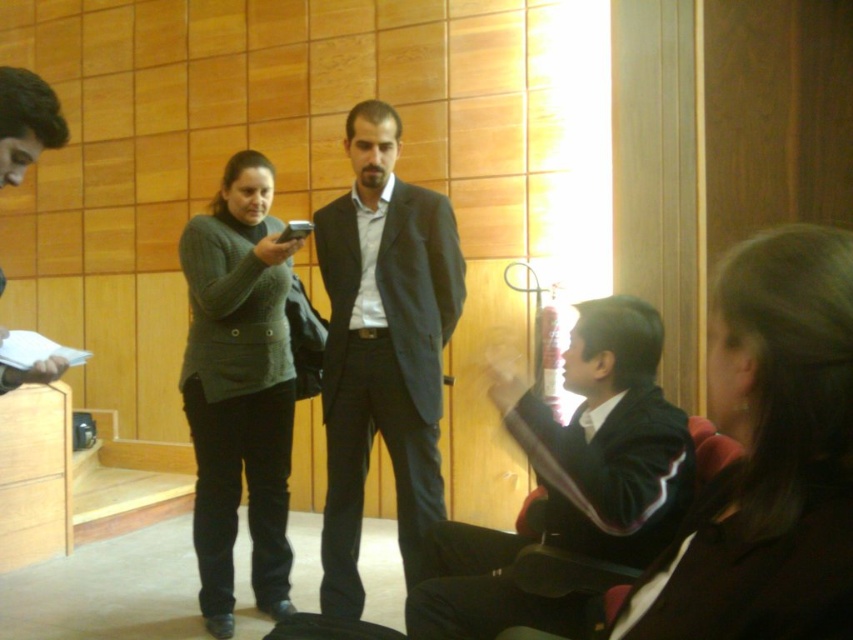
Question: Which point appears farthest from the camera in this image?

Choices:
 (A) (741, 592)
 (B) (509, 403)

Answer: (B)

Question: Among these objects, which one is nearest to the camera?

Choices:
 (A) matte black jacket at left
 (B) dark brown hair at lower right
 (C) knit sweater at center

Answer: (B)

Question: Estimate the real-world distances between objects in this image. Which object is farther from the knit sweater at center?

Choices:
 (A) black matte jacket at lower right
 (B) dark gray suit at center

Answer: (A)

Question: Is black matte jacket at lower right to the right of matte black jacket at left from the viewer's perspective?

Choices:
 (A) no
 (B) yes

Answer: (B)

Question: Considering the relative positions of dark gray suit at center and black matte jacket at lower right in the image provided, where is dark gray suit at center located with respect to black matte jacket at lower right?

Choices:
 (A) above
 (B) below

Answer: (A)

Question: Is the position of dark brown hair at lower right more distant than that of dark gray suit at center?

Choices:
 (A) yes
 (B) no

Answer: (B)